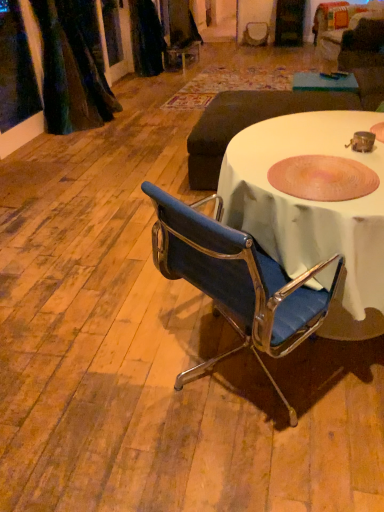
Question: Is velvet dark green curtain at upper left aimed at dark gray fabric ottoman at center?

Choices:
 (A) no
 (B) yes

Answer: (B)

Question: Is velvet dark green curtain at upper left positioned beyond the bounds of dark gray fabric ottoman at center?

Choices:
 (A) no
 (B) yes

Answer: (B)

Question: Considering the relative sizes of velvet dark green curtain at upper left and dark gray fabric ottoman at center in the image provided, is velvet dark green curtain at upper left smaller than dark gray fabric ottoman at center?

Choices:
 (A) no
 (B) yes

Answer: (B)

Question: Considering the relative sizes of velvet dark green curtain at upper left and dark gray fabric ottoman at center in the image provided, is velvet dark green curtain at upper left thinner than dark gray fabric ottoman at center?

Choices:
 (A) no
 (B) yes

Answer: (B)

Question: From the image's perspective, is velvet dark green curtain at upper left below dark gray fabric ottoman at center?

Choices:
 (A) no
 (B) yes

Answer: (A)

Question: From the image's perspective, is dark gray fabric ottoman at center located above or below green felt table at upper center?

Choices:
 (A) below
 (B) above

Answer: (A)

Question: Is dark gray fabric ottoman at center bigger or smaller than green felt table at upper center?

Choices:
 (A) big
 (B) small

Answer: (A)

Question: Considering their positions, is dark gray fabric ottoman at center located in front of or behind green felt table at upper center?

Choices:
 (A) behind
 (B) front

Answer: (B)

Question: From a real-world perspective, is dark gray fabric ottoman at center above or below green felt table at upper center?

Choices:
 (A) above
 (B) below

Answer: (B)

Question: In terms of height, does dark gray fabric ottoman at center look taller or shorter compared to pink textured bowl at center?

Choices:
 (A) tall
 (B) short

Answer: (A)

Question: From the image's perspective, is dark gray fabric ottoman at center located above or below pink textured bowl at center?

Choices:
 (A) below
 (B) above

Answer: (B)

Question: In terms of size, does dark gray fabric ottoman at center appear bigger or smaller than pink textured bowl at center?

Choices:
 (A) big
 (B) small

Answer: (A)

Question: Which is correct: dark gray fabric ottoman at center is inside pink textured bowl at center, or outside of it?

Choices:
 (A) outside
 (B) inside

Answer: (A)

Question: Visually, is green felt table at upper center positioned to the left or to the right of pink textured bowl at center?

Choices:
 (A) right
 (B) left

Answer: (A)

Question: Considering the positions of green felt table at upper center and pink textured bowl at center in the image, is green felt table at upper center taller or shorter than pink textured bowl at center?

Choices:
 (A) tall
 (B) short

Answer: (A)